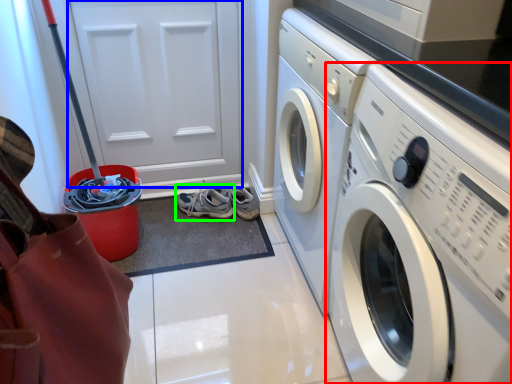
Question: Based on their relative distances, which object is nearer to washing machine (highlighted by a red box)? Choose from door (highlighted by a blue box) and running shoe (highlighted by a green box).

Choices:
 (A) door
 (B) running shoe

Answer: (B)